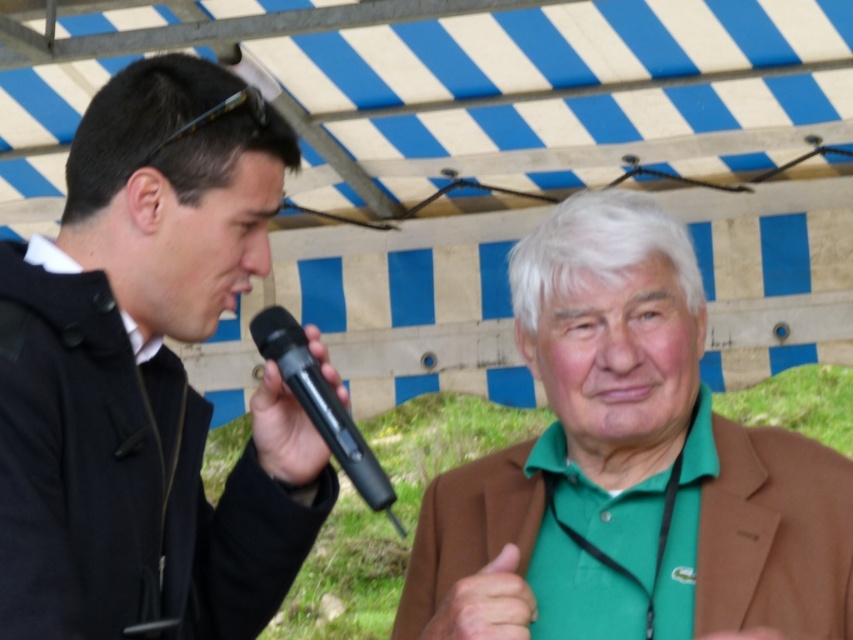
Question: Can you confirm if green fabric shirt at right is positioned above green matte hand at center?

Choices:
 (A) yes
 (B) no

Answer: (A)

Question: Which object appears closest to the camera in this image?

Choices:
 (A) green fabric shirt at right
 (B) black matte jacket at left
 (C) green matte hand at center
 (D) black plastic microphone at left

Answer: (B)

Question: Can you confirm if green fabric shirt at right is thinner than green matte hand at center?

Choices:
 (A) yes
 (B) no

Answer: (B)

Question: Which is nearer to the black plastic microphone at left?

Choices:
 (A) black plastic microphone at center
 (B) green fabric shirt at right
 (C) black matte jacket at left
 (D) green matte hand at center

Answer: (A)

Question: Which object is farther from the camera taking this photo?

Choices:
 (A) black matte jacket at left
 (B) green matte hand at center
 (C) black plastic microphone at center
 (D) black plastic microphone at left

Answer: (D)

Question: Considering the relative positions of black matte jacket at left and green matte hand at center in the image provided, where is black matte jacket at left located with respect to green matte hand at center?

Choices:
 (A) right
 (B) left

Answer: (B)